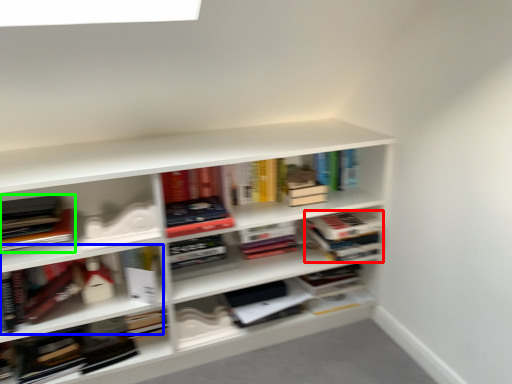
Question: Which object is positioned closest to book (highlighted by a red box)? Select from book (highlighted by a blue box) and book (highlighted by a green box).

Choices:
 (A) book
 (B) book

Answer: (A)